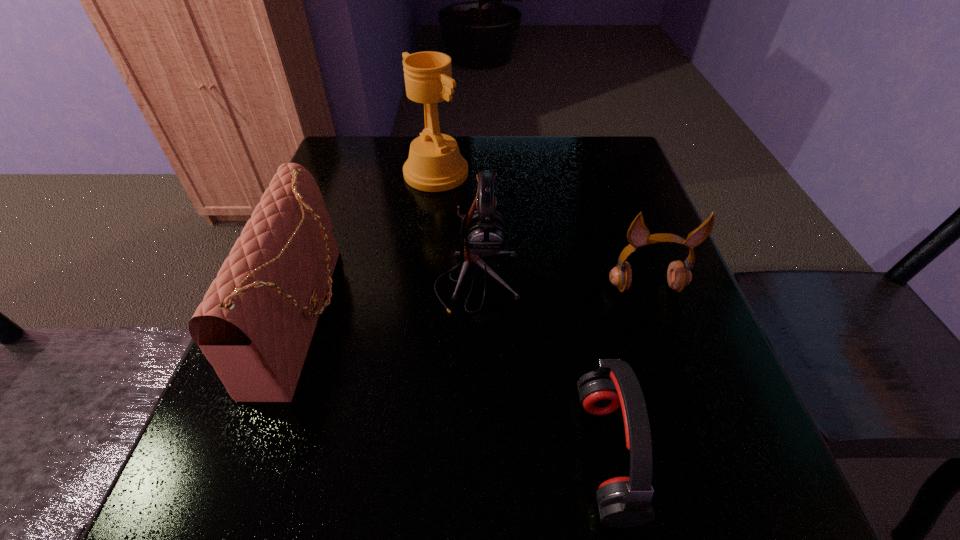
Where is `free space between the shortest object and the handbag`? The image size is (960, 540). free space between the shortest object and the handbag is located at coordinates (455, 385).

This screenshot has height=540, width=960. Find the location of `vacant point located between the tallest earphone and the handbag`. vacant point located between the tallest earphone and the handbag is located at coordinates (391, 299).

Identify which object is the second nearest to the handbag. Please provide its 2D coordinates. Your answer should be formatted as a tuple, i.e. [(x, y)], where the tuple contains the x and y coordinates of a point satisfying the conditions above.

[(435, 164)]

In order to click on object that stands as the third closest to the second earphone from left to right in this screenshot , I will do `click(255, 324)`.

Choose which earphone is the nearest neighbor to the shortest earphone. Please provide its 2D coordinates. Your answer should be formatted as a tuple, i.e. [(x, y)], where the tuple contains the x and y coordinates of a point satisfying the conditions above.

[(483, 232)]

Locate an element on the screen. The image size is (960, 540). earphone that is the third closest to the farthest object is located at coordinates pos(623,502).

Locate an element on the screen. vacant area in the image that satisfies the following two spatial constraints: 1. on the front-facing side of the rightmost object; 2. on the front-facing side of the leftmost object is located at coordinates pyautogui.click(x=657, y=316).

The image size is (960, 540). I want to click on free location that satisfies the following two spatial constraints: 1. on the front-facing side of the rightmost earphone; 2. on the front-facing side of the leftmost object, so click(x=657, y=316).

Find the location of a particular element. This screenshot has width=960, height=540. vacant space that satisfies the following two spatial constraints: 1. on the front-facing side of the rightmost object; 2. on the front-facing side of the handbag is located at coordinates (657, 316).

Identify the location of vacant area that satisfies the following two spatial constraints: 1. on the front side of the tallest object; 2. on the front-facing side of the leftmost object. This screenshot has width=960, height=540. (419, 316).